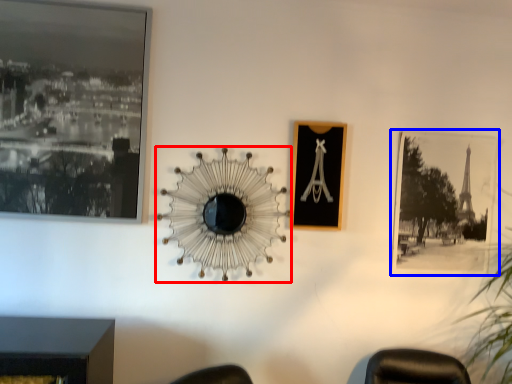
Question: Which object is further to the camera taking this photo, mirror (highlighted by a red box) or picture frame (highlighted by a blue box)?

Choices:
 (A) mirror
 (B) picture frame

Answer: (B)